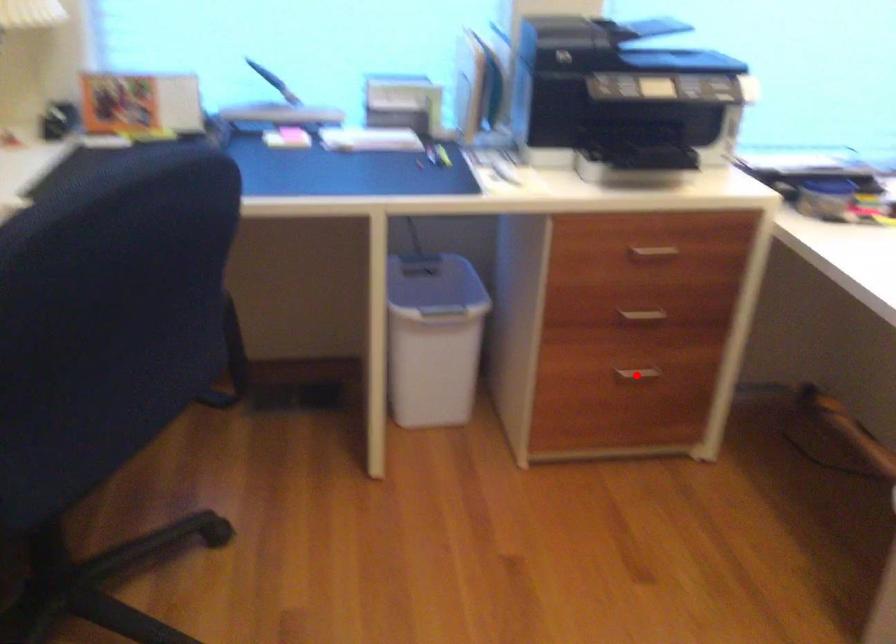
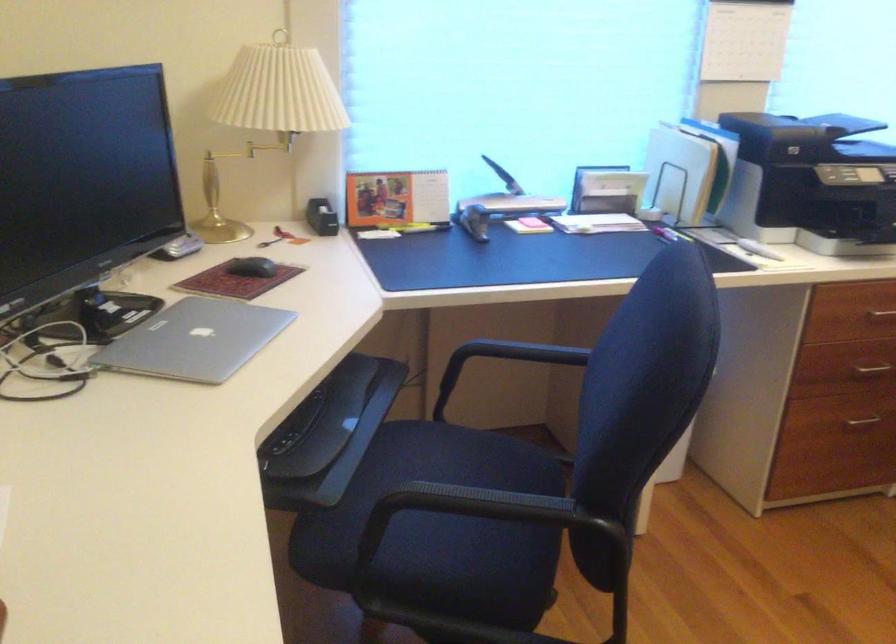
Question: I am providing you with two images of the same scene from different viewpoints. Given a red point in image1, look at the same physical point in image2. Is it:

Choices:
 (A) Closer to the viewpoint
 (B) Farther from the viewpoint

Answer: (B)